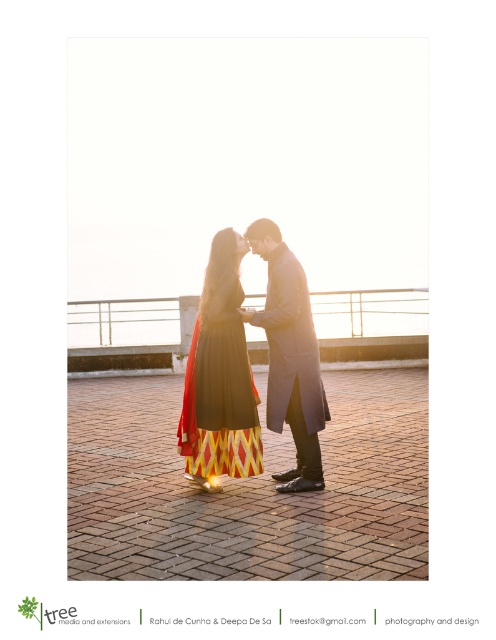
You are a photographer trying to capture the couple in the center of the image. You notice two points marked in the scene. The first point, point (242, 461), and the second point, point (198, 337). Which point is closer to the camera based on their positions?

Point (242, 461) is in front of point (198, 337), so it is closer to the camera.

You are a photographer trying to capture the couple in the scene. You notice two objects labeled as the matte black dress at center and the black matte dress at center. Which one is taller?

The matte black dress at center is much taller than the black matte dress at center.

You are a photographer trying to capture the couple in the scene. You need to focus your camera on the matte black dress at center. According to the coordinates provided, what are the exact coordinates where you should aim your camera?

The exact coordinates to aim your camera are at point (220, 376) where the matte black dress at center is located.